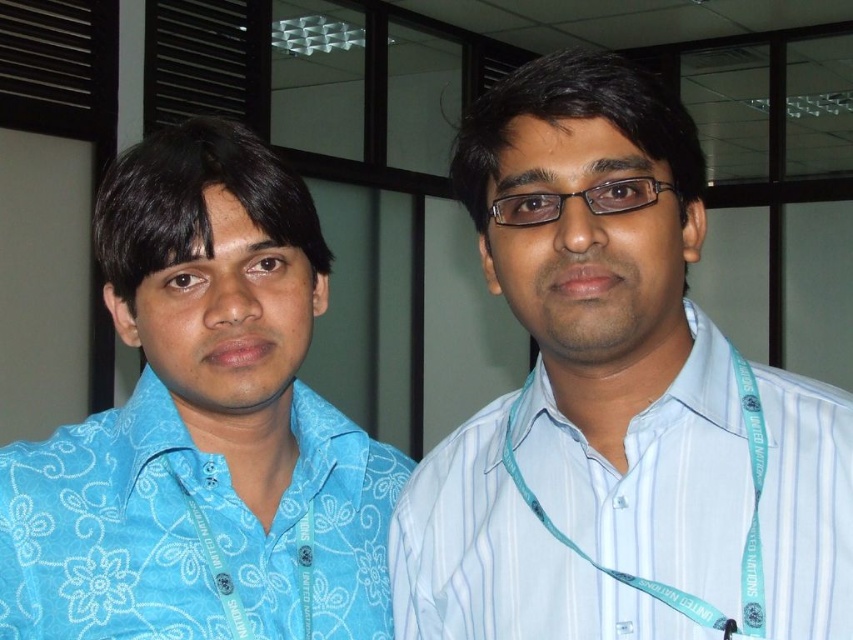
Question: Which object appears farthest from the camera in this image?

Choices:
 (A) white striped shirt at right
 (B) blue floral shirt at left

Answer: (B)

Question: Can you confirm if blue floral shirt at left is thinner than white striped shirt at right?

Choices:
 (A) no
 (B) yes

Answer: (B)

Question: Which object is farther from the camera taking this photo?

Choices:
 (A) white striped shirt at right
 (B) blue floral shirt at left

Answer: (B)

Question: Does blue floral shirt at left have a larger size compared to white striped shirt at right?

Choices:
 (A) no
 (B) yes

Answer: (B)

Question: Among these points, which one is nearest to the camera?

Choices:
 (A) (679, 465)
 (B) (321, 608)

Answer: (A)

Question: Does blue floral shirt at left have a lesser width compared to white striped shirt at right?

Choices:
 (A) yes
 (B) no

Answer: (A)